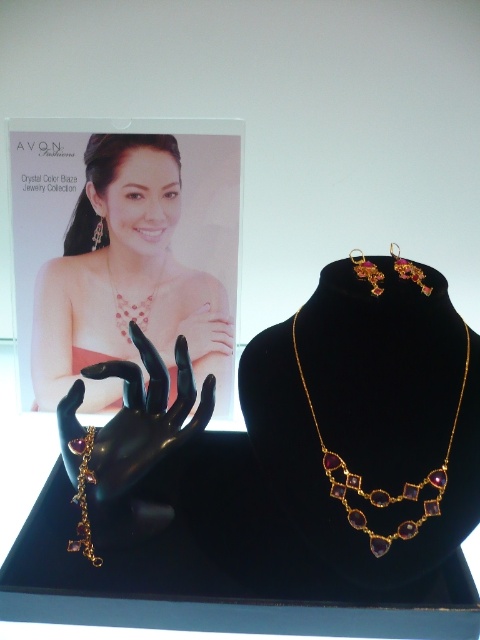
Question: Is amber-golden metal necklace at center to the right of shiny gold necklace at center from the viewer's perspective?

Choices:
 (A) no
 (B) yes

Answer: (B)

Question: Based on their relative distances, which object is nearer to the gold textured earrings at upper right?

Choices:
 (A) amber-golden metal necklace at center
 (B) pearl earrings at upper left
 (C) amber-gold chain bracelet at lower left

Answer: (A)

Question: Which of these objects is positioned farthest from the shiny gold necklace at center?

Choices:
 (A) gold textured earrings at upper right
 (B) amber-golden metal necklace at center
 (C) pearl earrings at upper left

Answer: (B)

Question: Can you confirm if matte gold necklace at center is positioned to the left of gold textured earrings at upper right?

Choices:
 (A) no
 (B) yes

Answer: (B)

Question: Which object is positioned closest to the amber-gold chain bracelet at lower left?

Choices:
 (A) matte gold necklace at center
 (B) shiny gold necklace at center

Answer: (B)

Question: Is matte gold necklace at center wider than gold textured earrings at upper right?

Choices:
 (A) no
 (B) yes

Answer: (B)